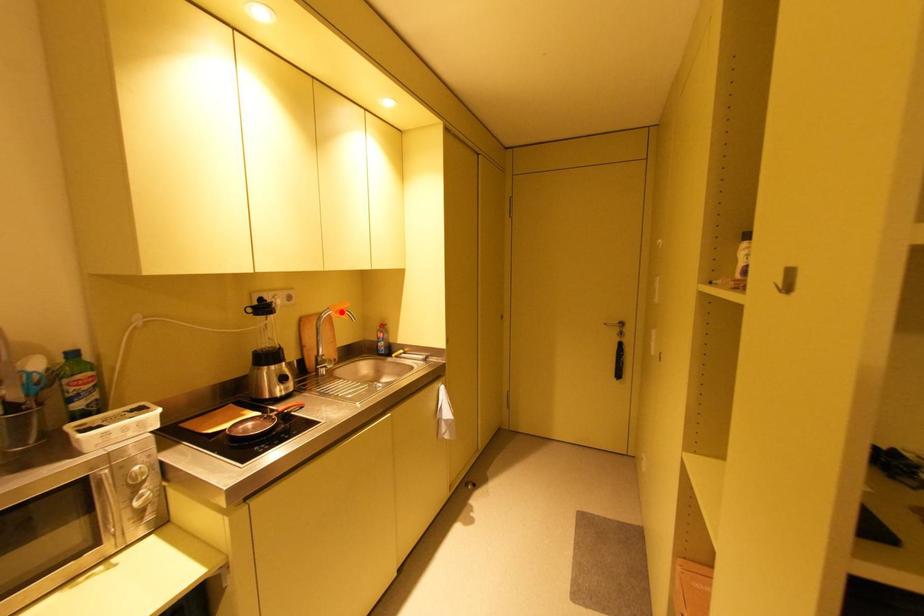
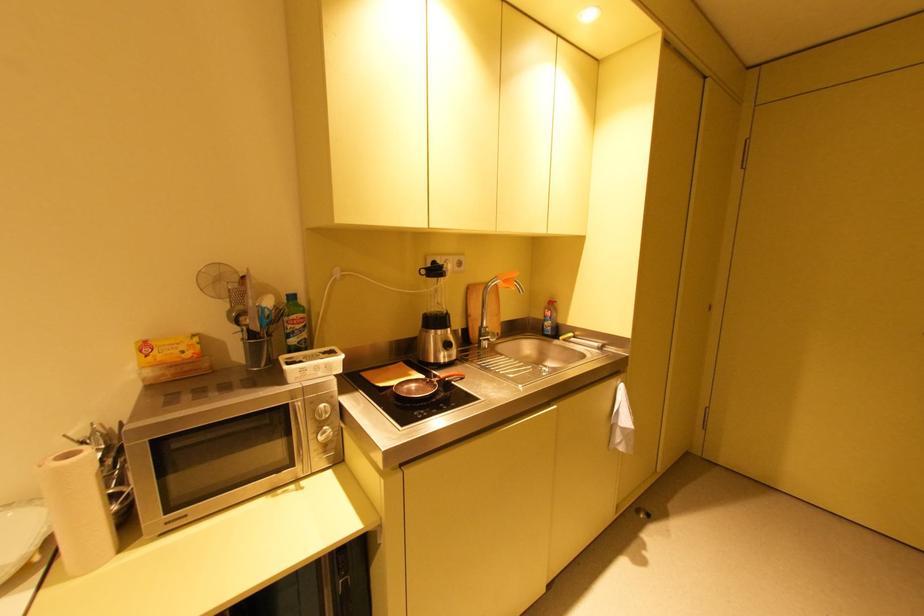
Where in the second image is the point corresponding to the highlighted location from the first image?

(508, 282)